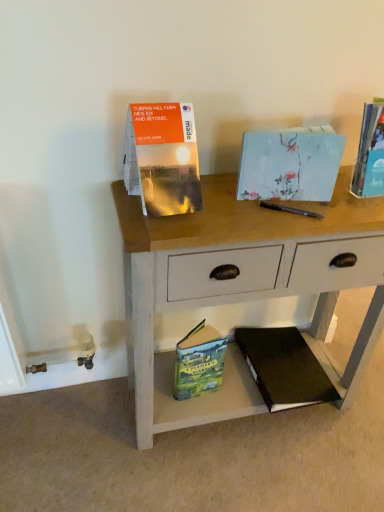
Where is `free space in front of light blue paper at center, the 4th paperback book from the bottom`? free space in front of light blue paper at center, the 4th paperback book from the bottom is located at coordinates (276, 222).